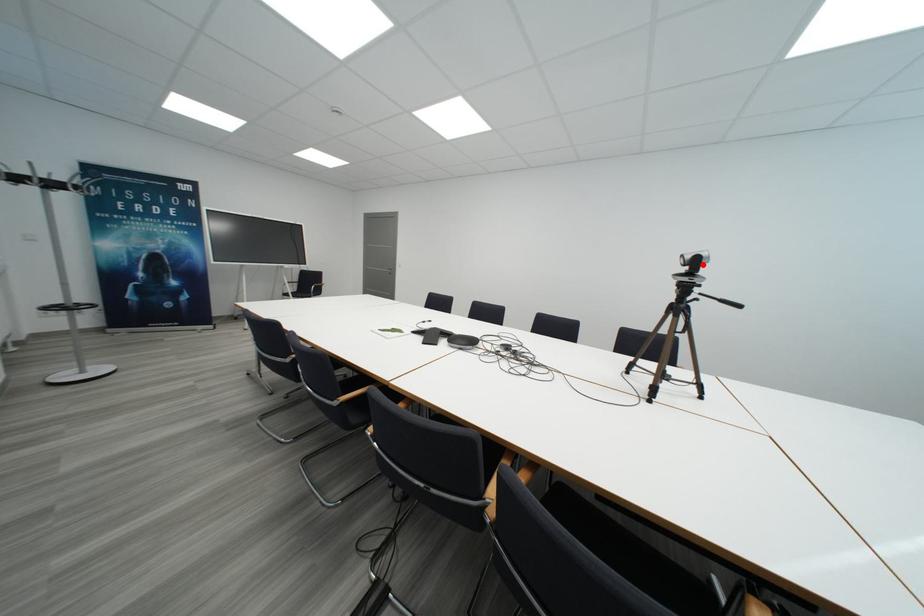
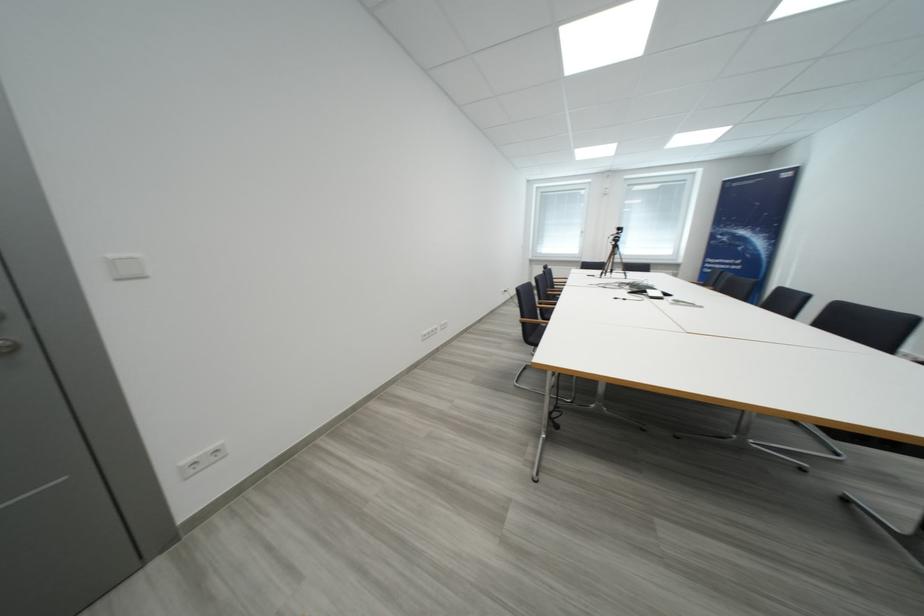
Question: I am providing you with two images of the same scene from different viewpoints. A red point is marked on the first image. Can you still see the location of the red point in image 2?

Choices:
 (A) Yes
 (B) No

Answer: (B)